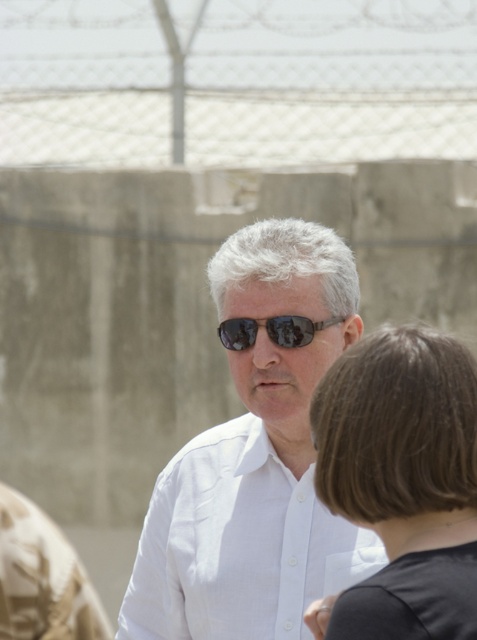
Question: Which point appears closest to the camera in this image?

Choices:
 (A) (406, 481)
 (B) (185, 156)
 (C) (270, 449)
 (D) (238, 333)

Answer: (A)

Question: Does metallic chain-link fence at upper center have a smaller size compared to black matte hair at center?

Choices:
 (A) yes
 (B) no

Answer: (A)

Question: Can you confirm if black matte hair at center is positioned above black reflective sunglasses at center?

Choices:
 (A) yes
 (B) no

Answer: (B)

Question: Which point is farther to the camera?

Choices:
 (A) metallic chain-link fence at upper center
 (B) white matte shirt at center
 (C) black reflective sunglasses at center

Answer: (A)

Question: Which of the following is the closest to the observer?

Choices:
 (A) metallic chain-link fence at upper center
 (B) white matte shirt at center

Answer: (B)

Question: Can you confirm if metallic chain-link fence at upper center is thinner than black matte hair at center?

Choices:
 (A) no
 (B) yes

Answer: (B)